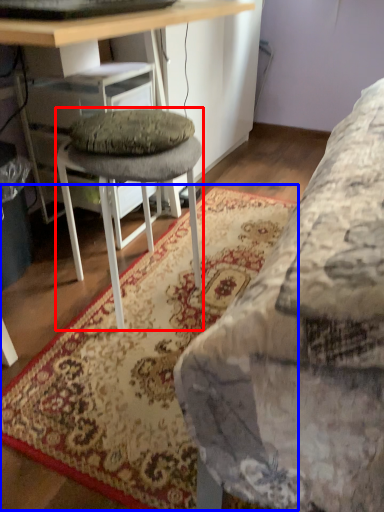
Question: Which object appears farthest to the camera in this image, stool (highlighted by a red box) or mat (highlighted by a blue box)?

Choices:
 (A) stool
 (B) mat

Answer: (A)